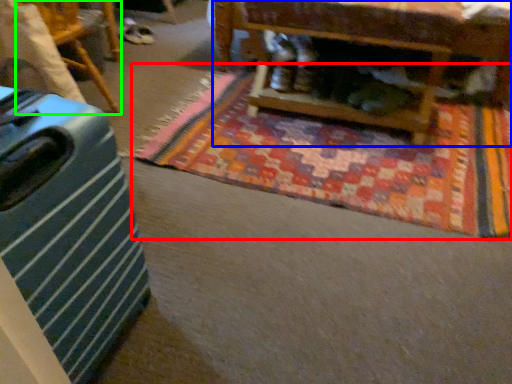
Question: Estimate the real-world distances between objects in this image. Which object is closer to mat (highlighted by a red box), furniture (highlighted by a blue box) or furniture (highlighted by a green box)?

Choices:
 (A) furniture
 (B) furniture

Answer: (A)